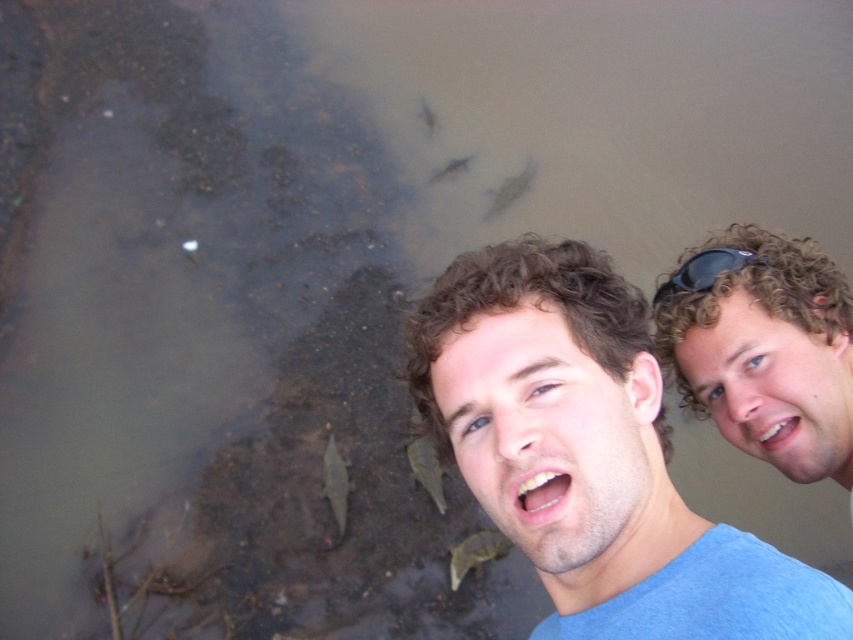
You are standing 2 meters away from a curly hair at center. Can you reach it with your hand?

The curly hair at center is 1.92 meters from viewer, so yes, you can reach it with your hand since it is within arm reach.

In the scene where two people are near a murky river with fish swimming around, you notice the curly hair at center and the green matte fish at lower center. From the perspective of someone standing where the person with the curly hair is, which object is positioned to the right?

The curly hair at center is to the right of the green matte fish at lower center, so from the perspective of the person with curly hair at center, the green matte fish at lower center is to their left.